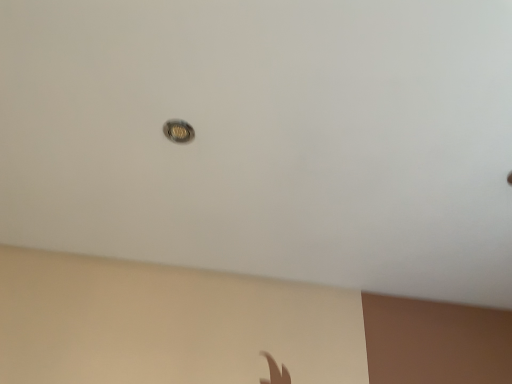
Where is `metallic droplight at center`? The height and width of the screenshot is (384, 512). metallic droplight at center is located at coordinates pyautogui.click(x=178, y=131).

Describe the element at coordinates (178, 131) in the screenshot. I see `metallic droplight at center` at that location.

Locate an element on the screen. metallic droplight at center is located at coordinates (178, 131).